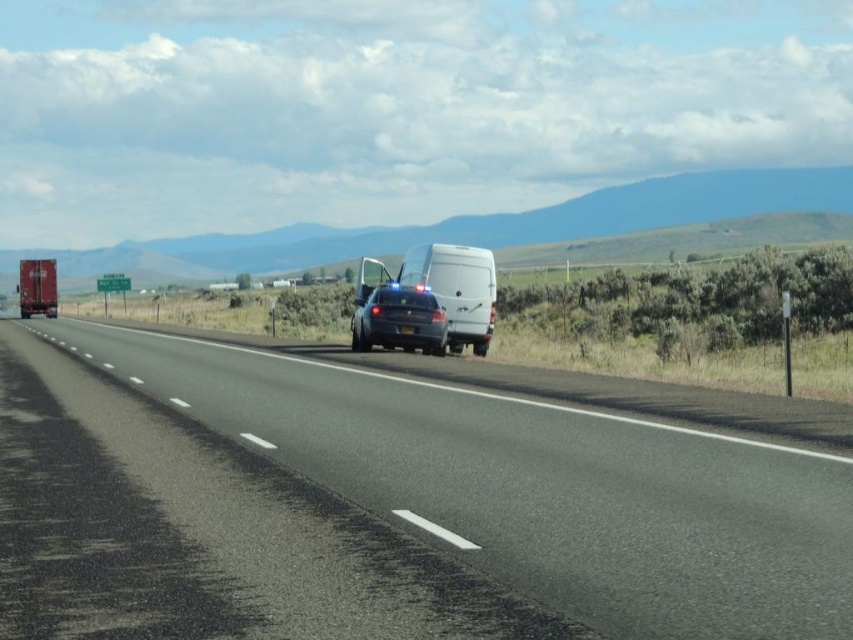
At what (x,y) coordinates should I click in order to perform the action: click on white matte van at center. Please return your answer as a coordinate pair (x, y). Looking at the image, I should click on pyautogui.click(x=456, y=289).

Between white matte van at center and metallic red trailer truck at left, which one appears on the right side from the viewer's perspective?

From the viewer's perspective, white matte van at center appears more on the right side.

What are the coordinates of `white matte van at center` in the screenshot? It's located at (456, 289).

Does satin black sedan at center have a larger size compared to metallic red trailer truck at left?

Incorrect, satin black sedan at center is not larger than metallic red trailer truck at left.

Is satin black sedan at center shorter than metallic red trailer truck at left?

Indeed, satin black sedan at center has a lesser height compared to metallic red trailer truck at left.

I want to click on satin black sedan at center, so pyautogui.click(x=398, y=321).

Can you confirm if black asphalt highway at center is shorter than metallic red trailer truck at left?

Indeed, black asphalt highway at center has a lesser height compared to metallic red trailer truck at left.

Does point (402, 452) lie behind point (33, 308)?

No.

This screenshot has height=640, width=853. Identify the location of black asphalt highway at center. (383, 508).